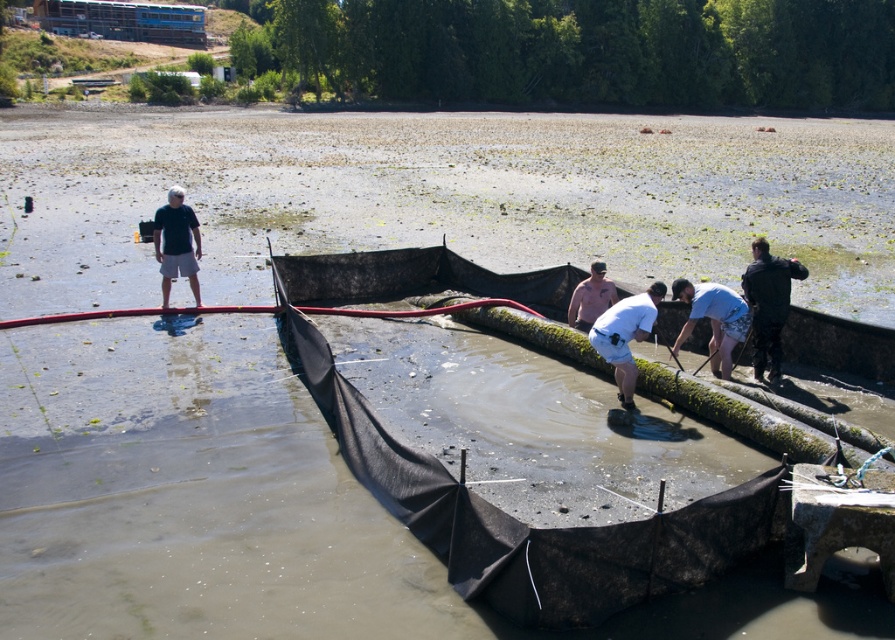
You are a lifeguard at the beach and see the dark matte wetsuit at right and the white matte shorts at center. Which clothing item is positioned higher in the image?

The dark matte wetsuit at right is located above the white matte shorts at center, so the dark matte wetsuit at right is higher.

You are a photographer trying to capture a photo of the two people in the scene. The person in the matte black shirt at left is much taller than the person in the pink matte shirt at center. To ensure both are visible in the frame, where should you position yourself relative to them?

Since the matte black shirt at left is much taller than the pink matte shirt at center, positioning yourself at a lower angle or closer to the ground would help ensure both individuals are fully visible in the photo.

You are a lifeguard at the lake and you see the white matte shorts at center and the matte black shirt at left. Which clothing item is shorter in height?

The white matte shorts at center is not as tall as the matte black shirt at left, so the white matte shorts at center is shorter in height.